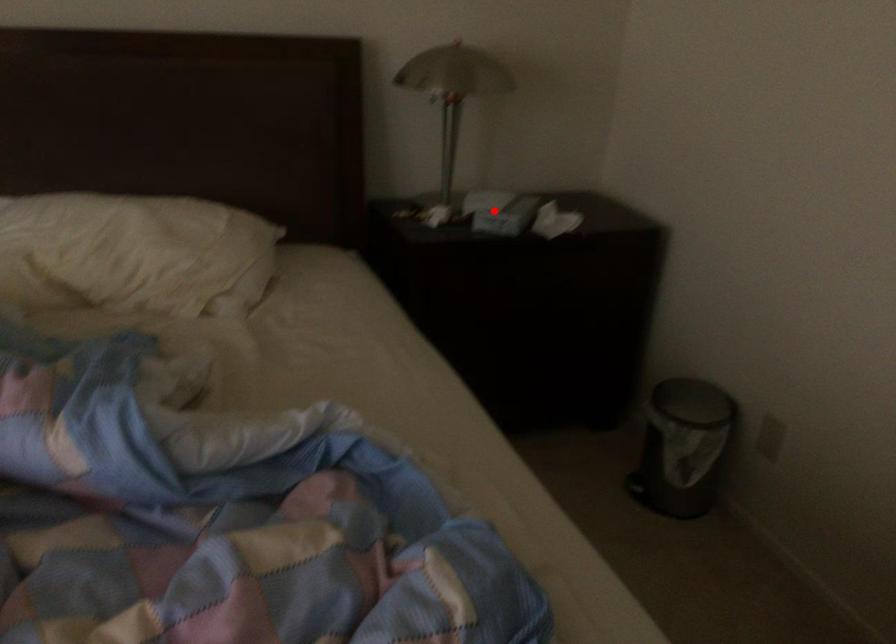
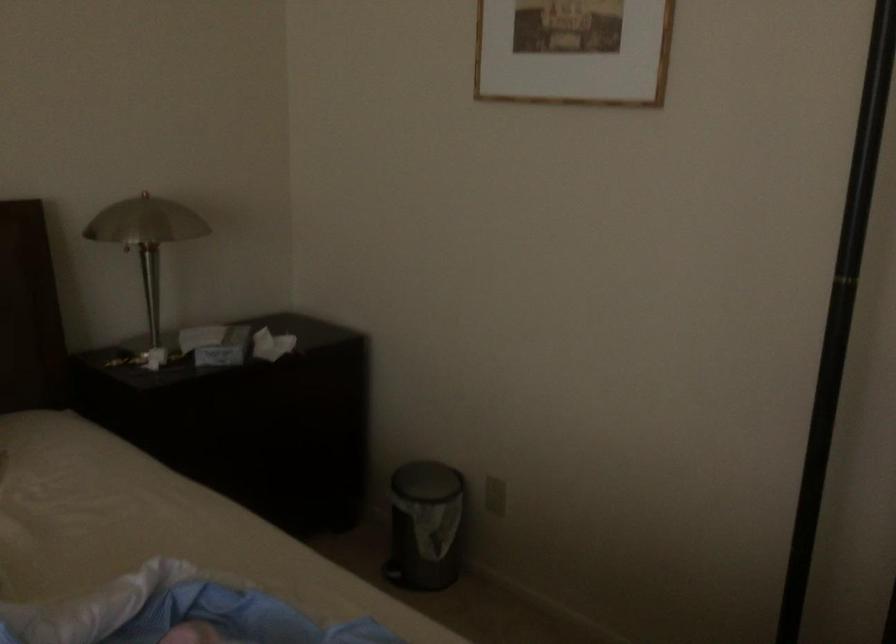
Where in the second image is the point corresponding to the highlighted location from the first image?

(216, 344)